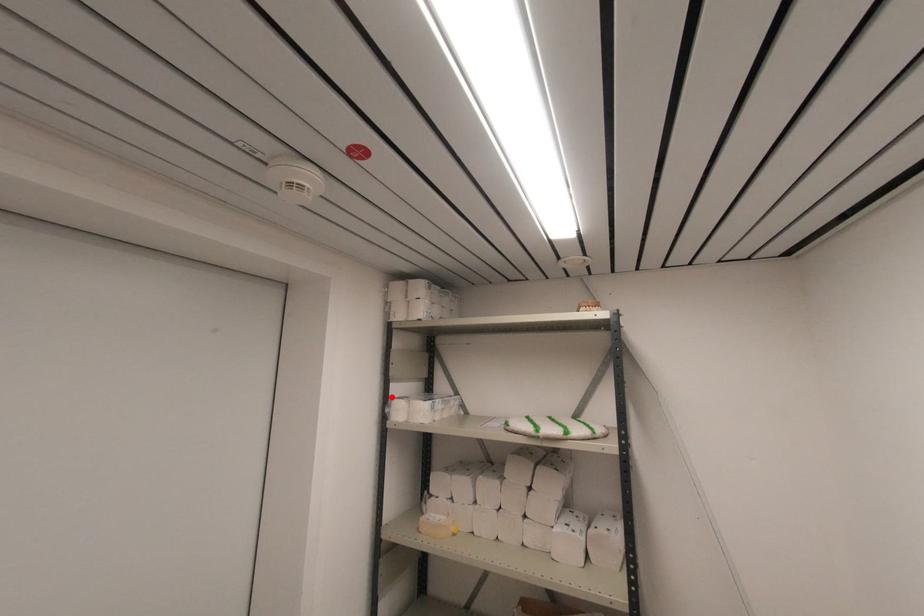
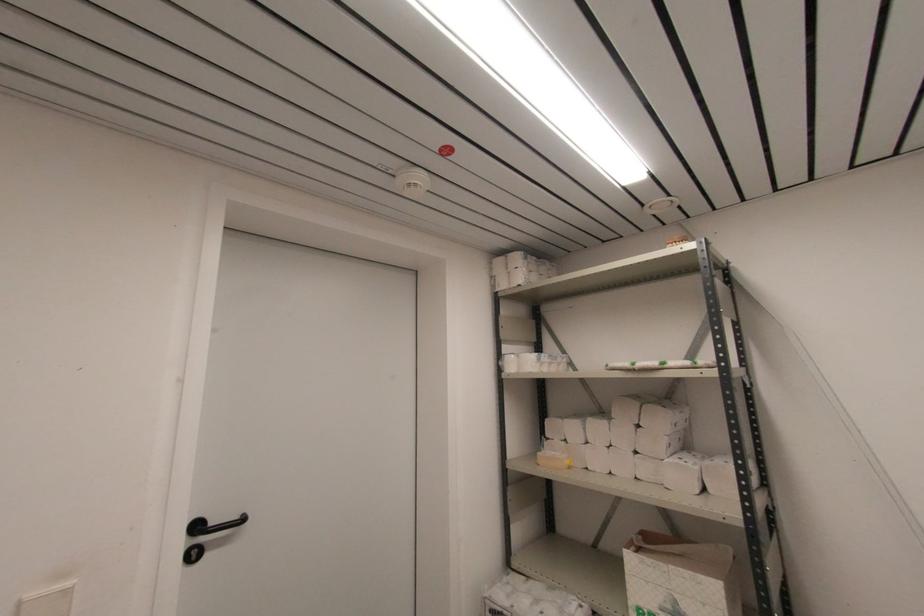
Where in the second image is the point corresponding to the highlighted location from the first image?

(504, 354)